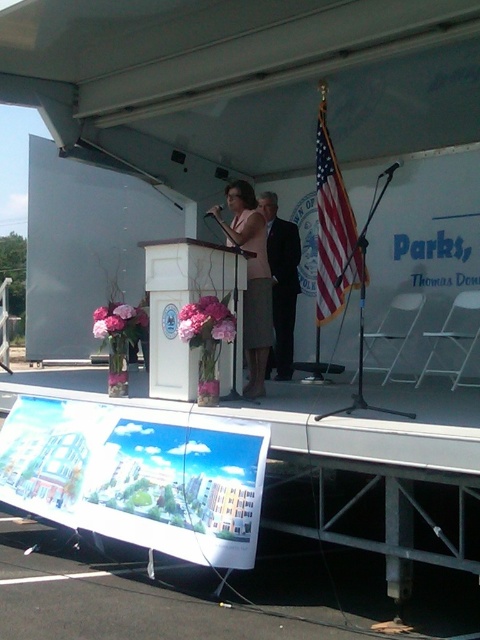
You are standing at the entrance of the event venue and want to locate the American flag. Based on the scene description, where would you find the american flag at center?

The american flag at center is located at the 2D coordinates point [334,230].

You are standing at the back of the event venue and want to approach the stage. There is an american flag at center and a matte pink dress at center. Which object will you encounter first as you walk towards the stage?

The american flag at center is closer to you than the matte pink dress at center, so you will encounter the american flag at center first as you walk towards the stage.